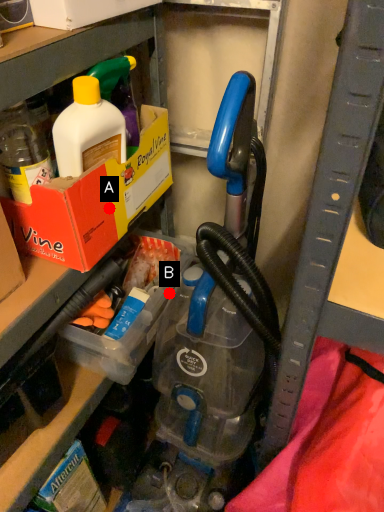
Question: Two points are circled on the image, labeled by A and B beside each circle. Which point is further to the camera?

Choices:
 (A) A is further
 (B) B is further

Answer: (B)